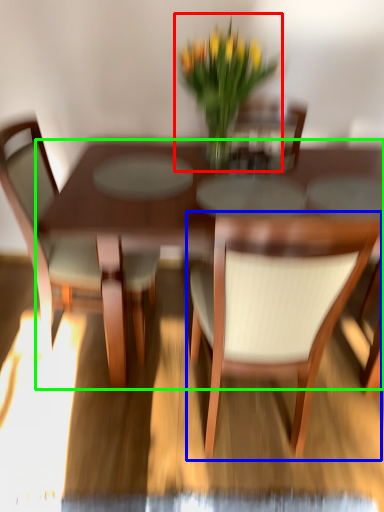
Question: Which object is positioned farthest from houseplant (highlighted by a red box)? Select from chair (highlighted by a blue box) and kitchen & dining room table (highlighted by a green box).

Choices:
 (A) chair
 (B) kitchen & dining room table

Answer: (A)